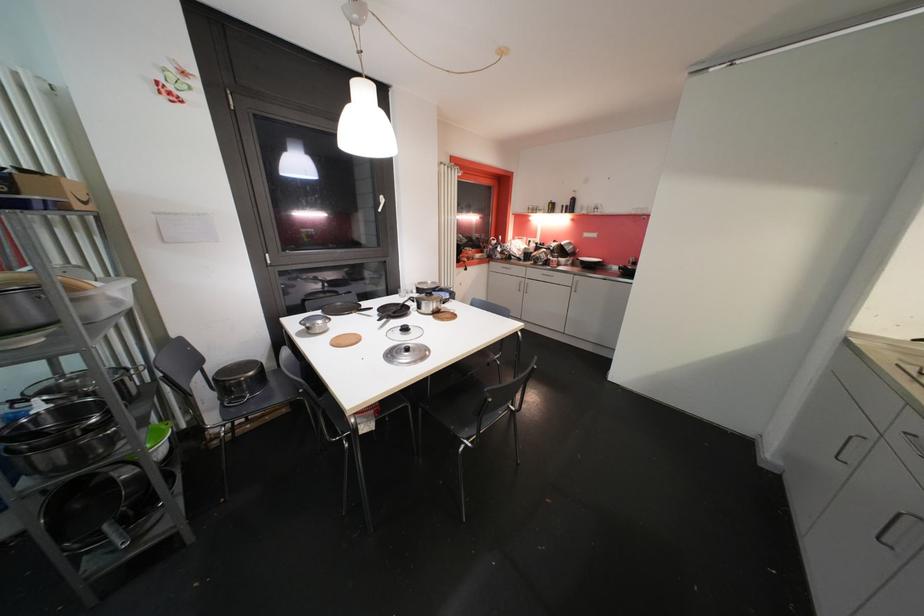
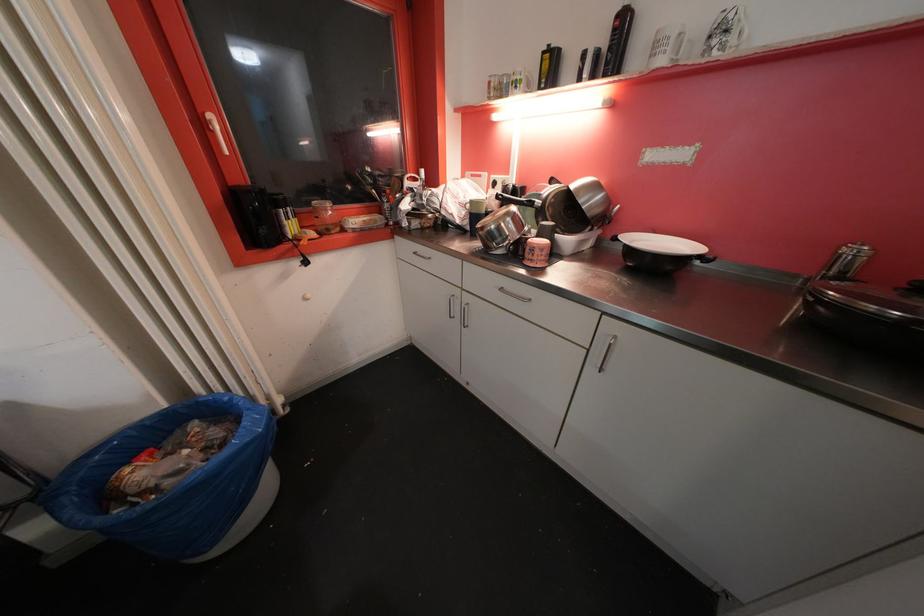
The point at (x=578, y=203) is marked in the first image. Where is the corresponding point in the second image?

(628, 25)